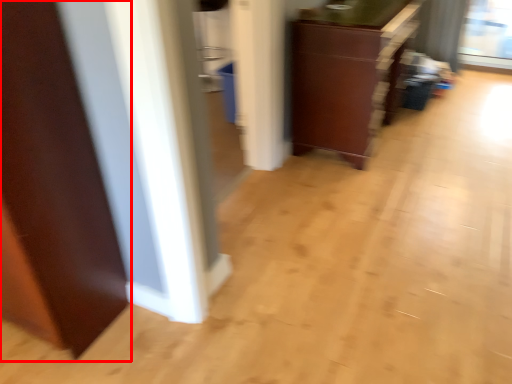
Question: From the image, what is the correct spatial relationship of door (annotated by the red box) in relation to cabinetry?

Choices:
 (A) right
 (B) left

Answer: (B)